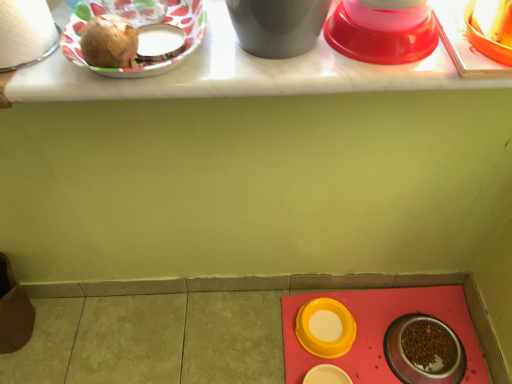
At what (x,y) coordinates should I click in order to perform the action: click on free space to the left of shiny brown onion at upper left. Please return your answer as a coordinate pair (x, y). This screenshot has height=384, width=512. Looking at the image, I should click on (49, 72).